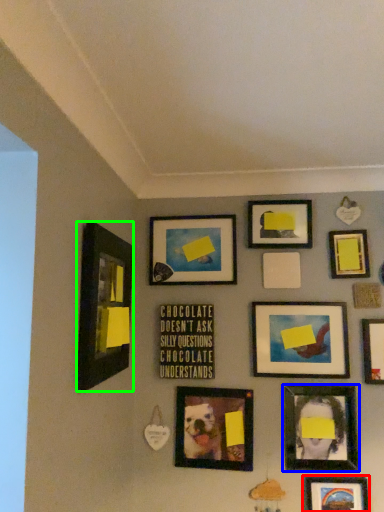
Question: Estimate the real-world distances between objects in this image. Which object is farther from picture frame (highlighted by a red box), picture frame (highlighted by a blue box) or picture frame (highlighted by a green box)?

Choices:
 (A) picture frame
 (B) picture frame

Answer: (B)